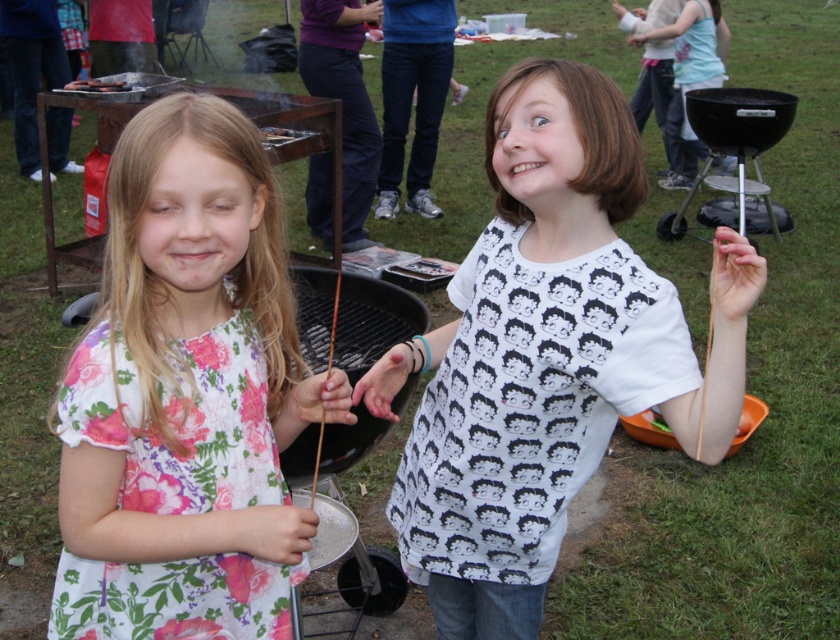
Can you confirm if white printed shirt at center is thinner than white printed shirt at upper right?

Indeed, white printed shirt at center has a lesser width compared to white printed shirt at upper right.

This screenshot has width=840, height=640. What do you see at coordinates (546, 355) in the screenshot?
I see `white printed shirt at center` at bounding box center [546, 355].

Is point (444, 522) positioned behind point (691, 20)?

No, (444, 522) is in front of (691, 20).

Locate an element on the screen. The height and width of the screenshot is (640, 840). white printed shirt at center is located at coordinates (546, 355).

Which is in front, point (193, 509) or point (717, 12)?

Point (193, 509) is more forward.

Is floral fabric dress at center bigger than white printed shirt at upper right?

No, floral fabric dress at center is not bigger than white printed shirt at upper right.

The width and height of the screenshot is (840, 640). In order to click on floral fabric dress at center in this screenshot , I will do `click(186, 396)`.

Locate an element on the screen. This screenshot has height=640, width=840. floral fabric dress at center is located at coordinates (186, 396).

Which is below, white printed shirt at center or floral fabric dress at center?

white printed shirt at center

How far apart are white printed shirt at center and floral fabric dress at center?

white printed shirt at center and floral fabric dress at center are 32.78 centimeters apart.

What do you see at coordinates (546, 355) in the screenshot? I see `white printed shirt at center` at bounding box center [546, 355].

Where is `white printed shirt at center`? white printed shirt at center is located at coordinates (546, 355).